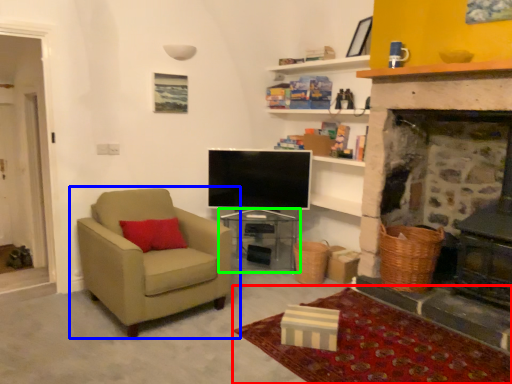
Question: Considering the real-world distances, which object is farthest from plain (highlighted by a red box)? chair (highlighted by a blue box) or table (highlighted by a green box)?

Choices:
 (A) chair
 (B) table

Answer: (B)